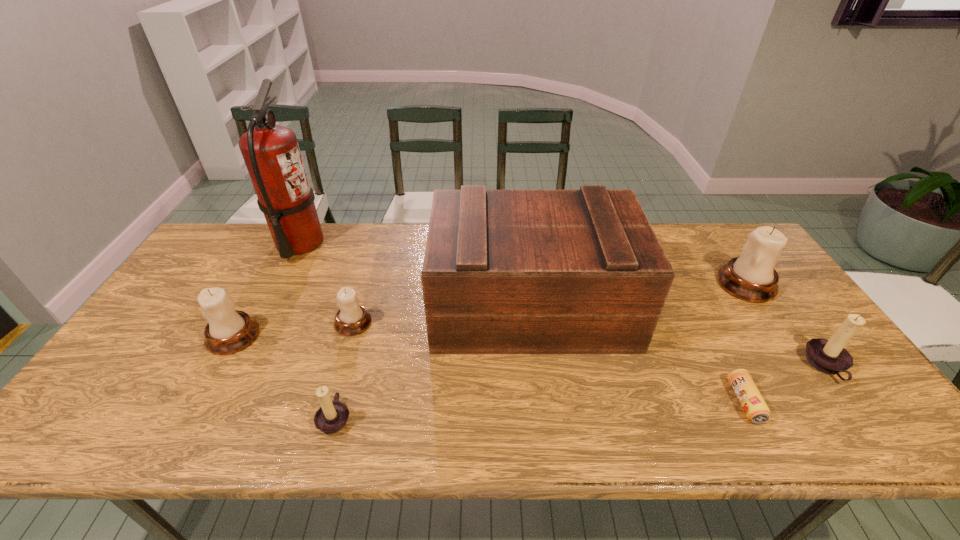
Locate an element on the screen. The width and height of the screenshot is (960, 540). the farthest object is located at coordinates (271, 153).

This screenshot has height=540, width=960. I want to click on fire extinguisher, so click(271, 153).

What are the coordinates of `box` in the screenshot? It's located at (582, 271).

Locate an element on the screen. the fourth object from right to left is located at coordinates (582, 271).

This screenshot has width=960, height=540. Find the location of `the rightmost white candle holder`. the rightmost white candle holder is located at coordinates (751, 277).

Locate an element on the screen. This screenshot has height=540, width=960. the farthest candle holder is located at coordinates (751, 277).

This screenshot has width=960, height=540. What are the coordinates of `the leftmost white candle holder` in the screenshot? It's located at (228, 331).

The height and width of the screenshot is (540, 960). In order to click on the leftmost candle holder in this screenshot , I will do `click(228, 331)`.

Locate an element on the screen. The height and width of the screenshot is (540, 960). the farther brown candle holder is located at coordinates (829, 356).

At what (x,y) coordinates should I click in order to perform the action: click on the right brown candle holder. Please return your answer as a coordinate pair (x, y). This screenshot has height=540, width=960. Looking at the image, I should click on (829, 356).